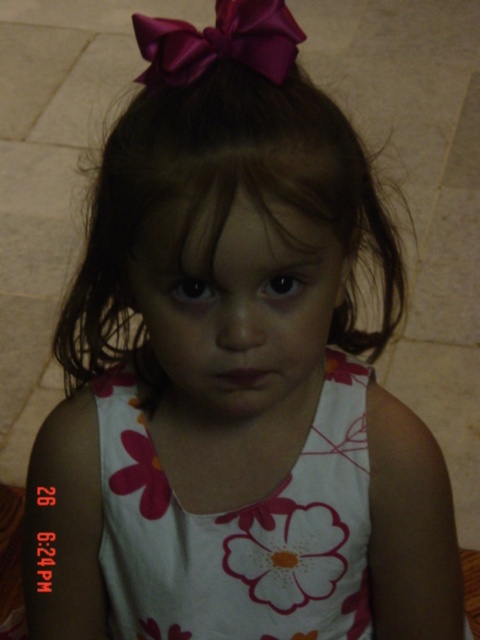
Question: Does white floral dress at center appear over satin purple bow at upper center?

Choices:
 (A) no
 (B) yes

Answer: (A)

Question: Does dark brown silky hair at center appear on the right side of white floral dress at center?

Choices:
 (A) yes
 (B) no

Answer: (A)

Question: Which object appears closest to the camera in this image?

Choices:
 (A) white floral dress at center
 (B) satin purple bow at upper center

Answer: (B)

Question: Is white floral dress at center positioned before satin purple bow at upper center?

Choices:
 (A) no
 (B) yes

Answer: (A)

Question: Which object appears farthest from the camera in this image?

Choices:
 (A) white floral dress at center
 (B) dark brown silky hair at center

Answer: (A)

Question: Which object appears closest to the camera in this image?

Choices:
 (A) dark brown silky hair at center
 (B) satin purple bow at upper center
 (C) smooth skin face at center
 (D) white floral dress at center

Answer: (A)